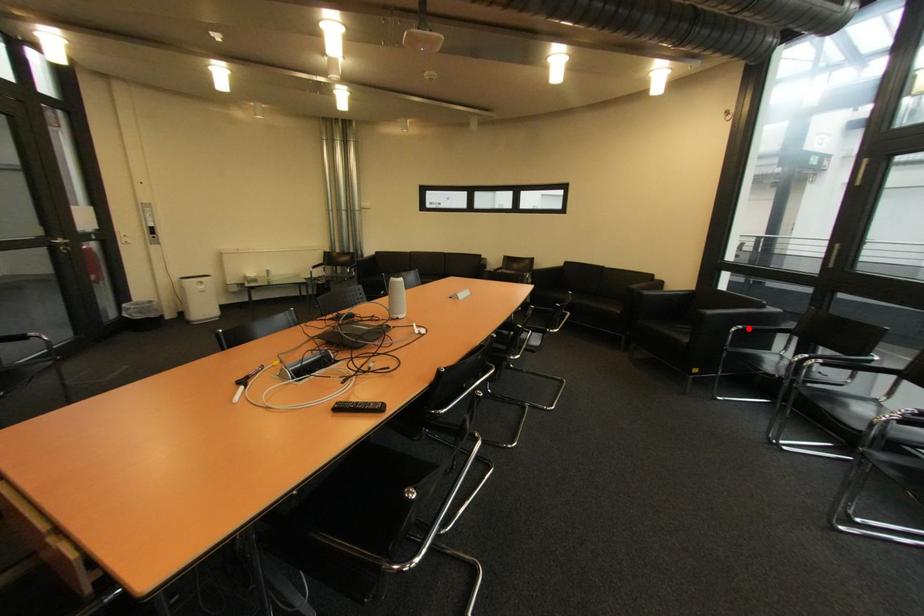
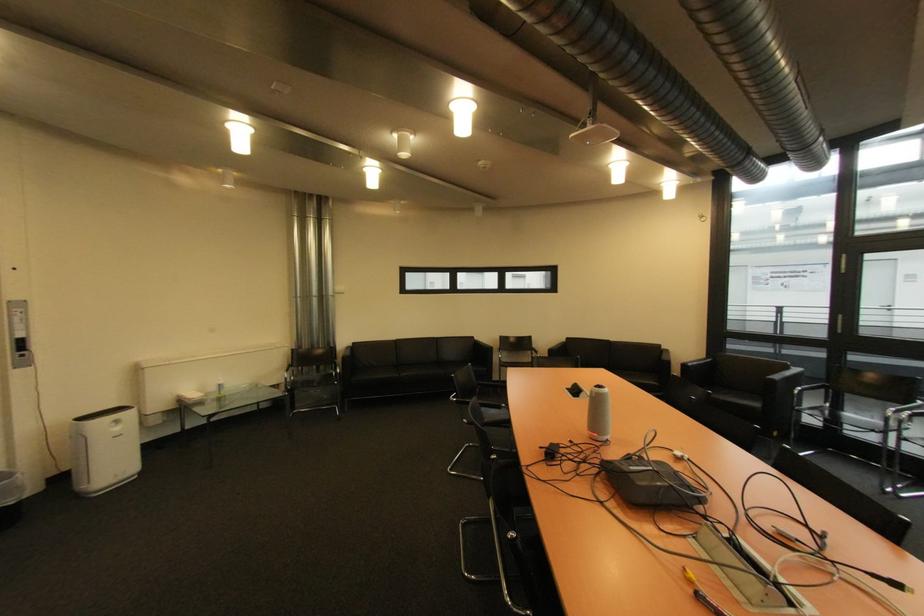
Find the pixel in the second image that matches the highlighted location in the first image.

(808, 390)